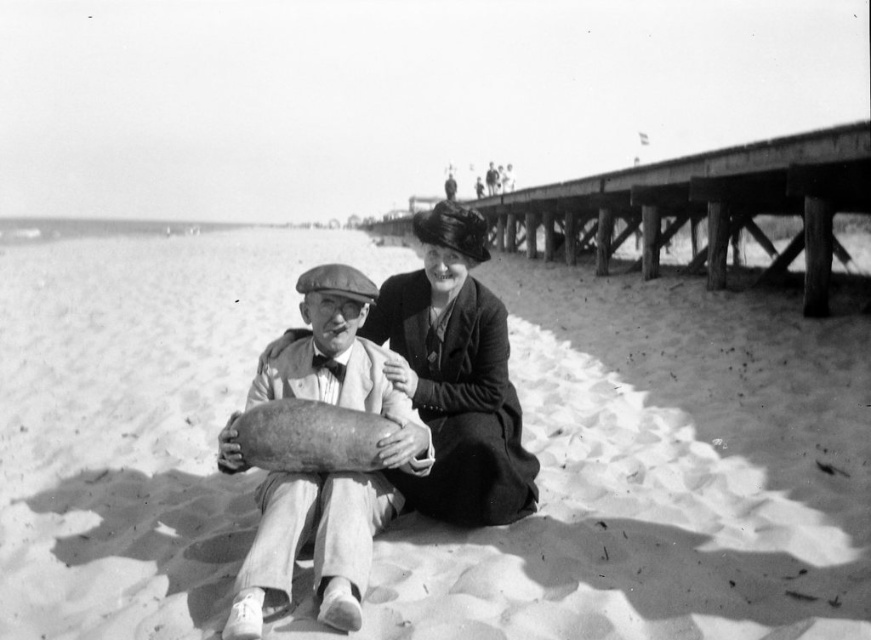
Which is above, wooden pier at upper right or smooth wooden cylinder at center?

wooden pier at upper right is above.

Is wooden pier at upper right shorter than smooth wooden cylinder at center?

No.

Is point (869, 168) in front of point (325, 365)?

No.

Find the location of a particular element. wooden pier at upper right is located at coordinates (703, 205).

Is smooth sand at center to the left of smooth wooden cylinder at center from the viewer's perspective?

In fact, smooth sand at center is to the right of smooth wooden cylinder at center.

This screenshot has width=871, height=640. Describe the element at coordinates (653, 476) in the screenshot. I see `smooth sand at center` at that location.

Is point (80, 532) closer to viewer compared to point (356, 552)?

No, (80, 532) is further to viewer.

What are the coordinates of `smooth sand at center` in the screenshot? It's located at (653, 476).

Between wooden pier at upper right and smooth fabric dress at center, which one has less height?

Standing shorter between the two is smooth fabric dress at center.

In the scene shown: Can you confirm if wooden pier at upper right is positioned below smooth fabric dress at center?

No, wooden pier at upper right is not below smooth fabric dress at center.

Is point (569, 253) less distant than point (422, 230)?

No, it is not.

Locate an element on the screen. This screenshot has width=871, height=640. wooden pier at upper right is located at coordinates (703, 205).